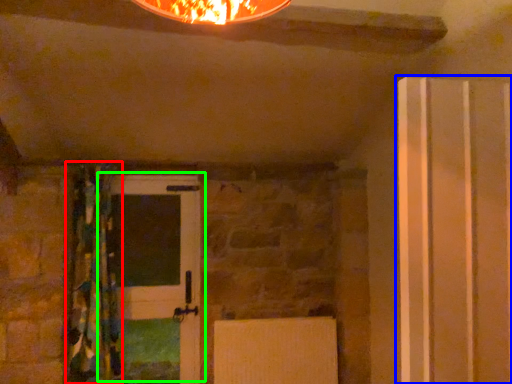
Question: Estimate the real-world distances between objects in this image. Which object is closer to curtain (highlighted by a red box), door (highlighted by a blue box) or door (highlighted by a green box)?

Choices:
 (A) door
 (B) door

Answer: (B)